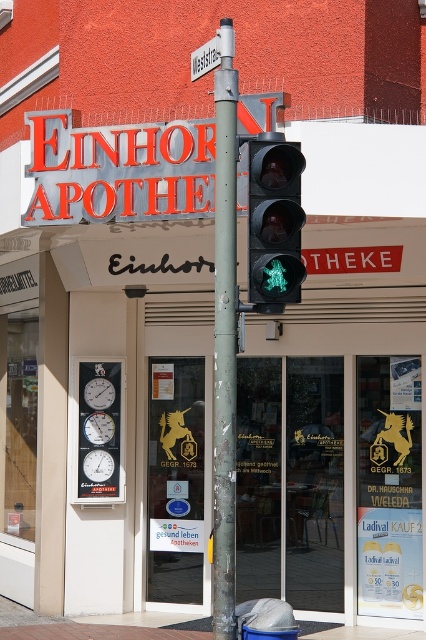
Between point (83, 452) and point (196, 65), which one is positioned in front?

Point (196, 65)

Is point (97, 388) less distant than point (207, 49)?

No, it is behind (207, 49).

Where is `white plastic clocks at left`? Image resolution: width=426 pixels, height=640 pixels. white plastic clocks at left is located at coordinates (100, 433).

Is metallic orange sign at upper center wider than black glass pedestrian signal at center?

Yes, metallic orange sign at upper center is wider than black glass pedestrian signal at center.

Where is `metallic orange sign at upper center`? metallic orange sign at upper center is located at coordinates (118, 170).

Between metallic orange sign at upper center and white plastic clocks at left, which one has more height?

white plastic clocks at left

In the scene shown: Is metallic orange sign at upper center to the right of white plastic clocks at left from the viewer's perspective?

Indeed, metallic orange sign at upper center is positioned on the right side of white plastic clocks at left.

Between point (176, 198) and point (120, 488), which one is positioned behind?

Positioned behind is point (120, 488).

Identify the location of metallic orange sign at upper center. click(x=118, y=170).